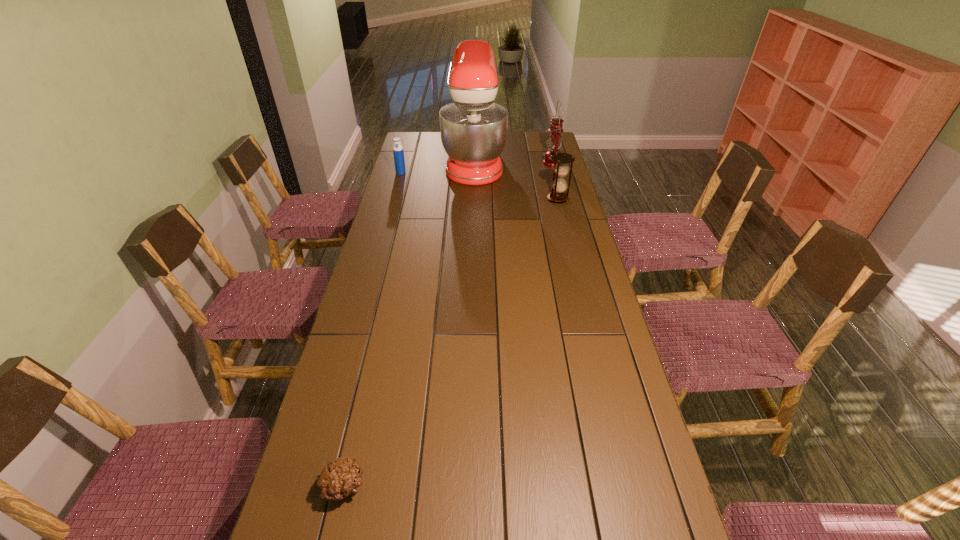
At what (x,y) coordinates should I click in order to perform the action: click on vacant point that satisfies the following two spatial constraints: 1. on the front-facing side of the third object from left to right; 2. on the front side of the water bottle. Please return your answer as a coordinate pair (x, y). Image resolution: width=960 pixels, height=540 pixels. Looking at the image, I should click on (474, 173).

Locate an element on the screen. The height and width of the screenshot is (540, 960). vacant space that satisfies the following two spatial constraints: 1. on the back side of the muffin; 2. on the left side of the oil lamp is located at coordinates (419, 163).